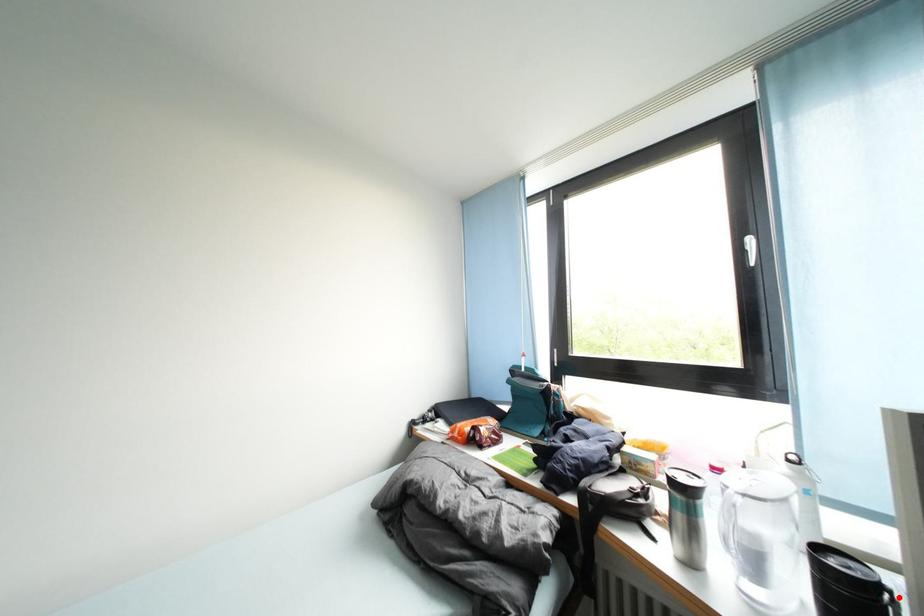
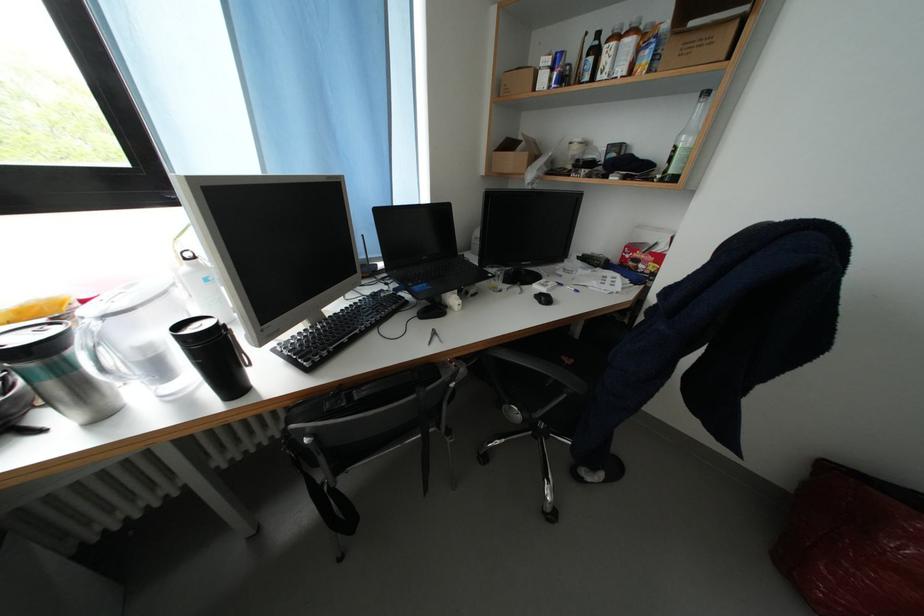
Question: I am providing you with two images of the same scene from different viewpoints. A red point is marked on the first image. At the location where the point appears in image 1, is it still visible in image 2?

Choices:
 (A) Yes
 (B) No

Answer: (B)